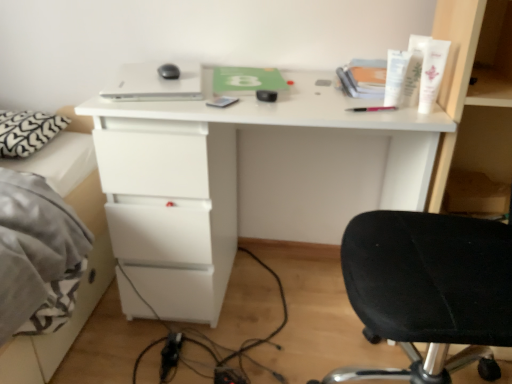
Question: Are white heart-patterned pillow at left and white matte desk at center located far from each other?

Choices:
 (A) yes
 (B) no

Answer: (B)

Question: Does white heart-patterned pillow at left have a lesser height compared to white matte desk at center?

Choices:
 (A) no
 (B) yes

Answer: (B)

Question: Is white matte desk at center at the back of white heart-patterned pillow at left?

Choices:
 (A) yes
 (B) no

Answer: (B)

Question: Is white heart-patterned pillow at left taller than white matte desk at center?

Choices:
 (A) no
 (B) yes

Answer: (A)

Question: Is white heart-patterned pillow at left further to the viewer compared to white matte desk at center?

Choices:
 (A) yes
 (B) no

Answer: (A)

Question: Would you say white plastic tube at upper right, which is the 2th toiletry in right-to-left order, is inside or outside white cream tube at upper right, which is counted as the first toiletry, starting from the left?

Choices:
 (A) outside
 (B) inside

Answer: (A)

Question: From the image's perspective, is white plastic tube at upper right, the second toiletry when ordered from left to right, located above or below white cream tube at upper right, the 3th toiletry positioned from the right?

Choices:
 (A) below
 (B) above

Answer: (B)

Question: Considering the positions of white plastic tube at upper right, which is the 2th toiletry in right-to-left order, and white cream tube at upper right, which is counted as the first toiletry, starting from the left, in the image, is white plastic tube at upper right, which is the 2th toiletry in right-to-left order, bigger or smaller than white cream tube at upper right, which is counted as the first toiletry, starting from the left,?

Choices:
 (A) big
 (B) small

Answer: (B)

Question: Considering the relative positions of white plastic tube at upper right, the second toiletry when ordered from left to right, and white cream tube at upper right, the 3th toiletry positioned from the right, in the image provided, is white plastic tube at upper right, the second toiletry when ordered from left to right, to the left or to the right of white cream tube at upper right, the 3th toiletry positioned from the right,?

Choices:
 (A) left
 (B) right

Answer: (B)

Question: Is point (18, 127) closer or farther from the camera than point (221, 99)?

Choices:
 (A) closer
 (B) farther

Answer: (B)

Question: From a real-world perspective, is white heart-patterned pillow at left positioned above or below matte gray notepad at center?

Choices:
 (A) above
 (B) below

Answer: (B)

Question: Is white heart-patterned pillow at left in front of or behind matte gray notepad at center in the image?

Choices:
 (A) front
 (B) behind

Answer: (B)

Question: Is white heart-patterned pillow at left to the left or to the right of matte gray notepad at center in the image?

Choices:
 (A) left
 (B) right

Answer: (A)

Question: Choose the correct answer: Is white matte desk at center inside white cream tube at upper right, which is counted as the first toiletry, starting from the left, or outside it?

Choices:
 (A) inside
 (B) outside

Answer: (B)

Question: Relative to white cream tube at upper right, the 3th toiletry positioned from the right, is white matte desk at center in front or behind?

Choices:
 (A) front
 (B) behind

Answer: (A)